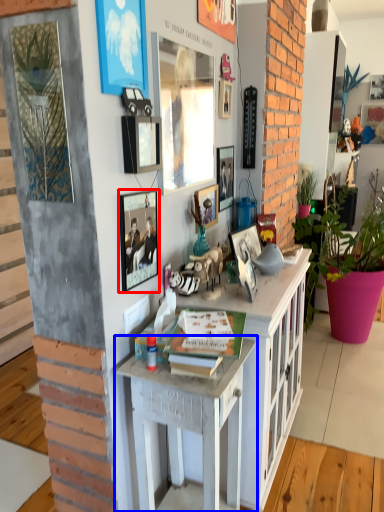
Question: Which point is further to the camera, picture frame (highlighted by a red box) or desk (highlighted by a blue box)?

Choices:
 (A) picture frame
 (B) desk

Answer: (A)